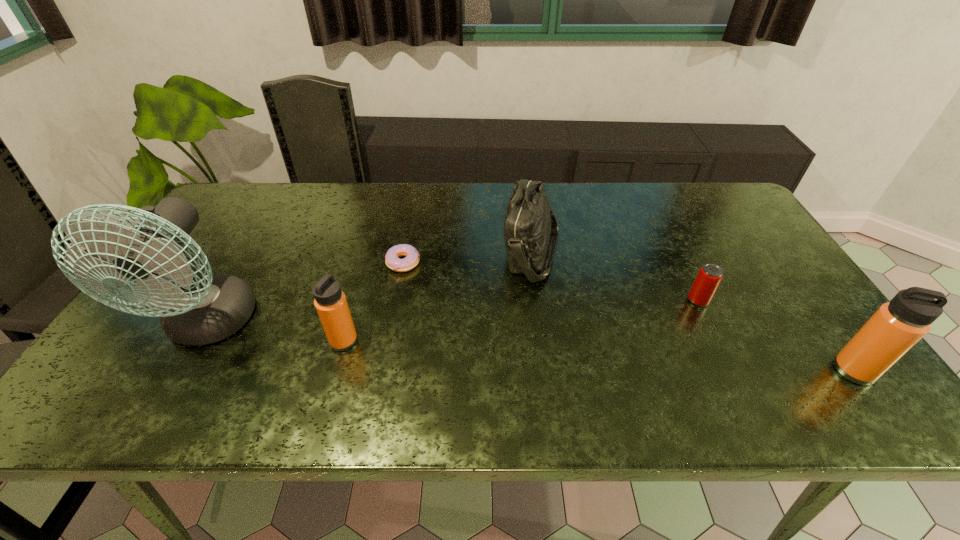
Identify the location of fan. (202, 309).

In order to click on vacant area located 0.110m on the right of the shorter thermos bottle in this screenshot , I will do `click(404, 341)`.

Identify the location of free space located on the left of the nearer thermos bottle. (678, 370).

You are a GUI agent. You are given a task and a screenshot of the screen. Output one action in this format:
    pyautogui.click(x=<x>, y=<y>)
    Task: Click on the vacant space located 0.130m at the front padded panel of the fourth object from left to right
    
    Given the screenshot: What is the action you would take?
    pyautogui.click(x=456, y=253)

Image resolution: width=960 pixels, height=540 pixels. In order to click on free point located 0.140m at the front padded panel of the fourth object from left to right in this screenshot , I will do `click(453, 253)`.

This screenshot has width=960, height=540. What are the coordinates of `free spot located 0.330m at the front padded panel of the fourth object from left to right` in the screenshot? It's located at (387, 253).

Find the location of `vacant region located 0.120m on the left of the third object from left to right`. vacant region located 0.120m on the left of the third object from left to right is located at coordinates (344, 262).

You are a GUI agent. You are given a task and a screenshot of the screen. Output one action in this format:
    pyautogui.click(x=<x>, y=<y>)
    Task: Click on the vacant space located on the left of the fifth object from left to right
    The image size is (960, 540).
    Given the screenshot: What is the action you would take?
    pyautogui.click(x=532, y=300)

The image size is (960, 540). Identify the location of object located at the far edge. (530, 228).

The image size is (960, 540). Identify the location of fan present at the near edge. (202, 309).